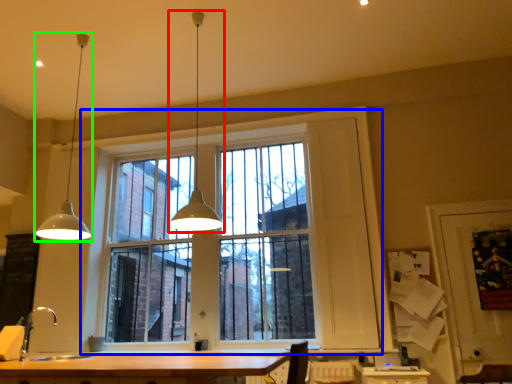
Question: Which object is positioned closest to lamp (highlighted by a red box)? Select from window (highlighted by a blue box) and lamp (highlighted by a green box).

Choices:
 (A) window
 (B) lamp

Answer: (B)